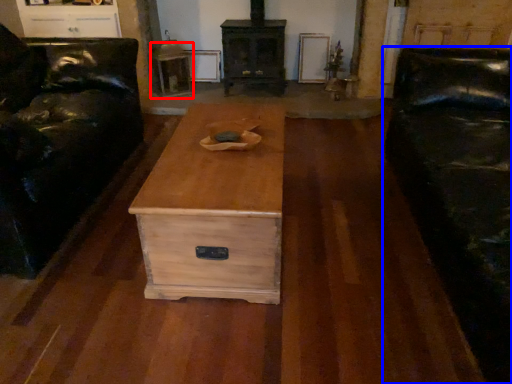
Question: Which of the following is the closest to the observer, side table (highlighted by a red box) or studio couch (highlighted by a blue box)?

Choices:
 (A) side table
 (B) studio couch

Answer: (B)